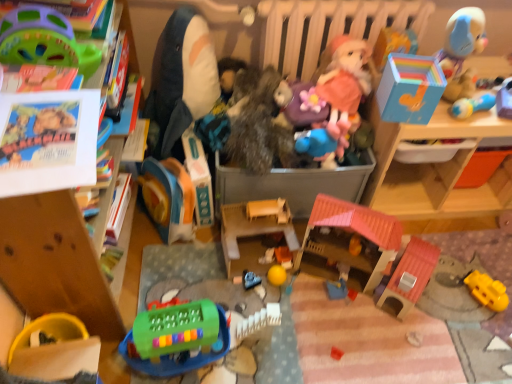
Where is `free point to the left of smooth blue car at center, arranged as the sixth toy when viewed from the left`? This screenshot has height=384, width=512. free point to the left of smooth blue car at center, arranged as the sixth toy when viewed from the left is located at coordinates (207, 277).